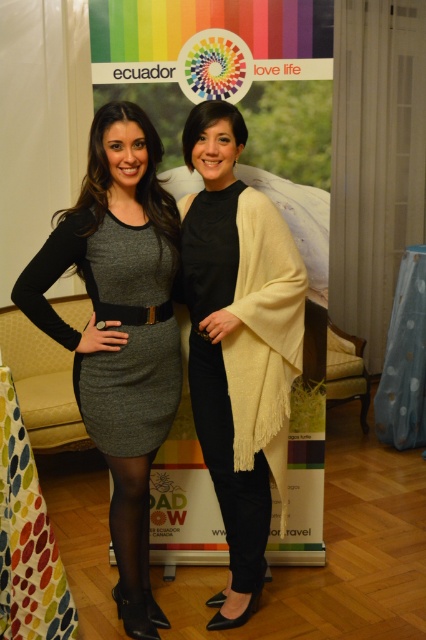
You are a fashion designer observing two outfits in an image. You see a gray wool dress at center and a black denim jeans at center. Which outfit is wider?

The gray wool dress at center is wider than the black denim jeans at center.

You are an interior designer who needs to place a new sofa in the living room. The sofa must be positioned exactly at the coordinates where the matte gray dress at center is located. What are the coordinates where you should place the sofa?

The coordinates for placing the sofa should be at point (120,328), as this is where the matte gray dress at center is positioned.

You are a photographer setting up a shot of the two women in front of the Ecuador promotional banner. The creamy woolen shawl at center is part of the scene. Where should you position the shawl relative to the women to ensure it is centered in the frame?

The creamy woolen shawl at center is already located at point [238,344], which is near the center of the frame. To keep it centered, position it around that coordinate.